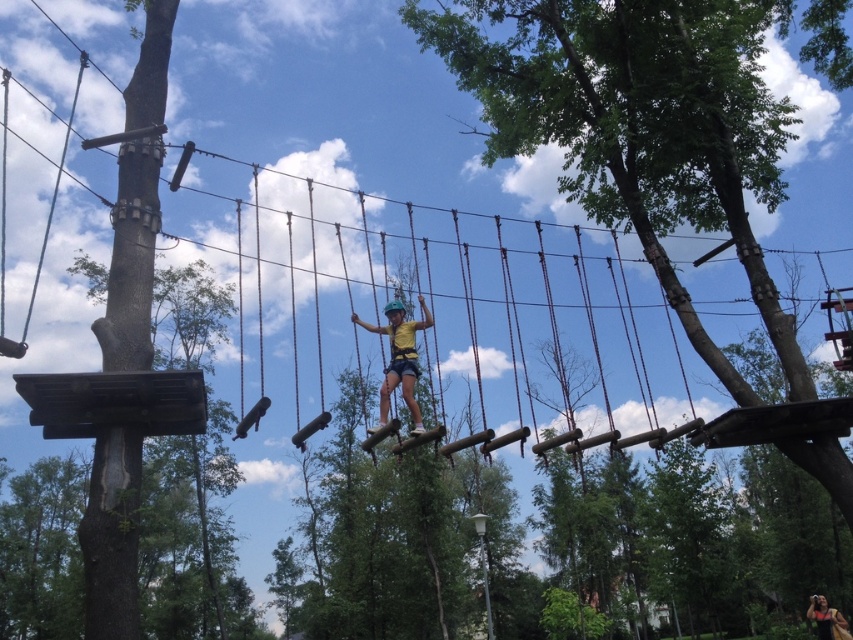
Between yellow fabric harness at center and matte yellow shirt at center, which one appears on the left side from the viewer's perspective?

yellow fabric harness at center

Consider the image. Who is more distant from viewer, (424, 326) or (817, 636)?

The point (817, 636) is more distant.

You are a GUI agent. You are given a task and a screenshot of the screen. Output one action in this format:
    pyautogui.click(x=<x>, y=<y>)
    Task: Click on the yellow fabric harness at center
    Image resolution: width=853 pixels, height=640 pixels.
    Given the screenshot: What is the action you would take?
    pyautogui.click(x=399, y=358)

Is point (94, 445) positioned in front of point (809, 614)?

Yes, it is in front of point (809, 614).

Is point (90, 611) behind point (820, 616)?

No.

Locate an element on the screen. This screenshot has width=853, height=640. brown wood pole at left is located at coordinates (112, 538).

How much distance is there between green wood tree at upper center and brown wood pole at left?

A distance of 8.62 meters exists between green wood tree at upper center and brown wood pole at left.

Can you confirm if green wood tree at upper center is smaller than brown wood pole at left?

No, green wood tree at upper center is not smaller than brown wood pole at left.

Does point (560, 26) come in front of point (111, 536)?

No, it is not.

Identify the location of green wood tree at upper center. (639, 124).